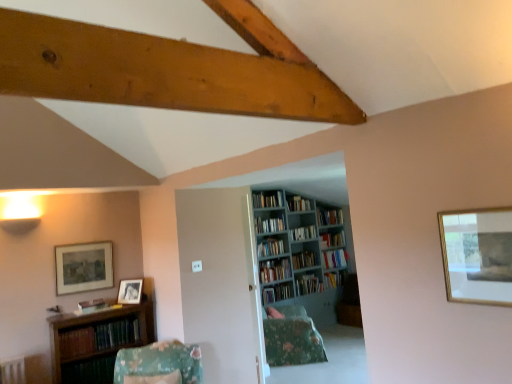
You are a GUI agent. You are given a task and a screenshot of the screen. Output one action in this format:
    pyautogui.click(x=<x>, y=<y>)
    Task: Click on the blank space situated above hardcover books at lower left, arranged as the second book when viewed from the front (from a real-world perspective)
    The image size is (512, 384).
    Given the screenshot: What is the action you would take?
    pyautogui.click(x=101, y=322)